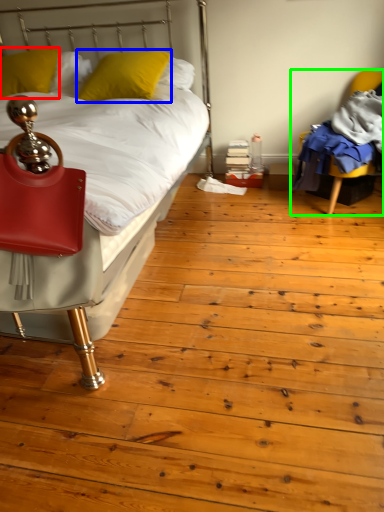
Question: Estimate the real-world distances between objects in this image. Which object is closer to pillow (highlighted by a red box), pillow (highlighted by a blue box) or chair (highlighted by a green box)?

Choices:
 (A) pillow
 (B) chair

Answer: (A)